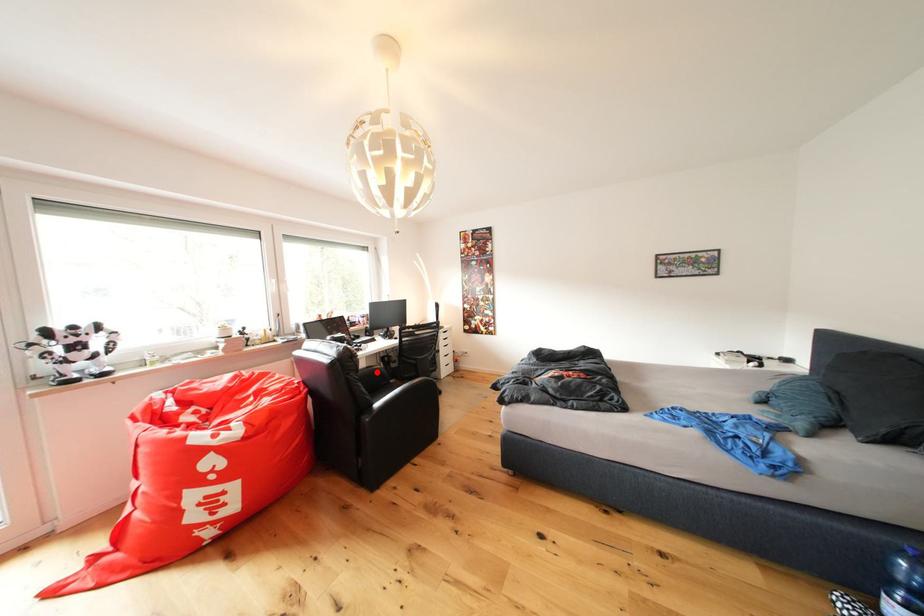
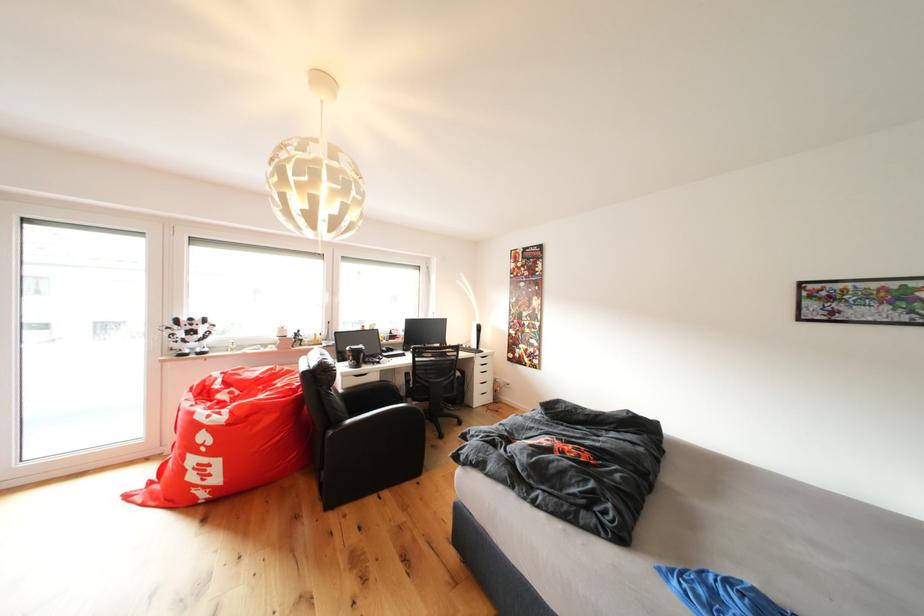
Where in the second image is the point corresponding to the highlighted location from the first image?

(390, 387)